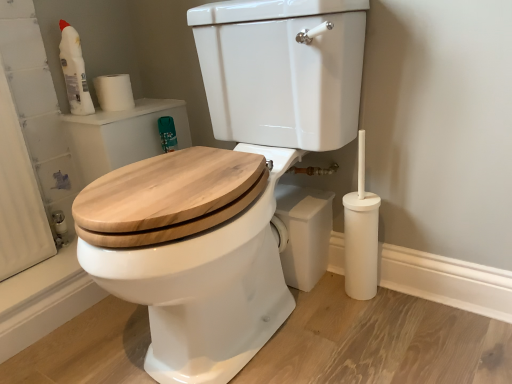
Question: From a real-world perspective, is white plastic bottle at upper left located beneath natural wood toilet seat at center?

Choices:
 (A) yes
 (B) no

Answer: (B)

Question: Can you confirm if white plastic bottle at upper left is wider than natural wood toilet seat at center?

Choices:
 (A) no
 (B) yes

Answer: (A)

Question: Considering the relative sizes of white plastic bottle at upper left and natural wood toilet seat at center in the image provided, is white plastic bottle at upper left smaller than natural wood toilet seat at center?

Choices:
 (A) yes
 (B) no

Answer: (A)

Question: From the image's perspective, does white plastic bottle at upper left appear higher than natural wood toilet seat at center?

Choices:
 (A) yes
 (B) no

Answer: (A)

Question: Is the position of white plastic bottle at upper left more distant than that of natural wood toilet seat at center?

Choices:
 (A) no
 (B) yes

Answer: (B)

Question: Visually, is white plastic bottle at upper left positioned to the left or to the right of white plastic toilet brush at lower right?

Choices:
 (A) left
 (B) right

Answer: (A)

Question: Looking at their shapes, would you say white plastic bottle at upper left is wider or thinner than white plastic toilet brush at lower right?

Choices:
 (A) thin
 (B) wide

Answer: (A)

Question: Is white plastic bottle at upper left taller or shorter than white plastic toilet brush at lower right?

Choices:
 (A) short
 (B) tall

Answer: (A)

Question: From the image's perspective, is white plastic bottle at upper left above or below white plastic toilet brush at lower right?

Choices:
 (A) above
 (B) below

Answer: (A)

Question: Is white plastic bottle at upper left wider or thinner than white matte toilet paper at upper left?

Choices:
 (A) thin
 (B) wide

Answer: (A)

Question: Is white plastic bottle at upper left in front of or behind white matte toilet paper at upper left in the image?

Choices:
 (A) behind
 (B) front

Answer: (B)

Question: From the image's perspective, is white plastic bottle at upper left located above or below white matte toilet paper at upper left?

Choices:
 (A) below
 (B) above

Answer: (B)

Question: Is point (84, 89) positioned closer to the camera than point (105, 74)?

Choices:
 (A) farther
 (B) closer

Answer: (B)

Question: From the image's perspective, relative to natural wood toilet seat at center, is white plastic toilet brush at lower right above or below?

Choices:
 (A) below
 (B) above

Answer: (A)

Question: In terms of height, does white plastic toilet brush at lower right look taller or shorter compared to natural wood toilet seat at center?

Choices:
 (A) short
 (B) tall

Answer: (A)